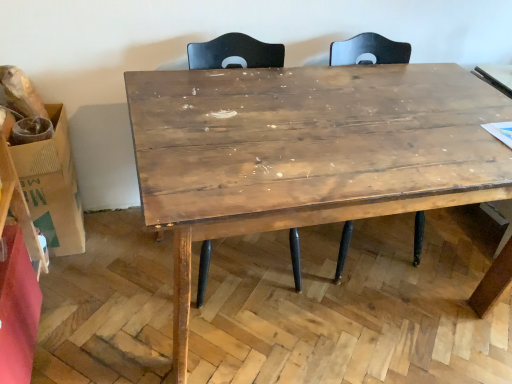
What is the approximate width of brown cardboard box at left?

brown cardboard box at left is 11.65 inches wide.

You are a GUI agent. You are given a task and a screenshot of the screen. Output one action in this format:
    pyautogui.click(x=<x>, y=<y>)
    Task: Click on the wooden table at center
    The height and width of the screenshot is (384, 512).
    Given the screenshot: What is the action you would take?
    pyautogui.click(x=306, y=151)

Is brown cardboard box at left at the left side of wooden table at center?

Yes.

Is brown cardboard box at left taller than wooden table at center?

In fact, brown cardboard box at left may be shorter than wooden table at center.

Which is closer, (x=28, y=172) or (x=195, y=223)?

Clearly, point (x=28, y=172) is more distant from the camera than point (x=195, y=223).

Which of these two, brown cardboard box at left or wooden table at center, is wider?

With larger width is wooden table at center.

Between matte wood swivel chair at center and wooden table at center, which one is positioned behind?

matte wood swivel chair at center is further from the camera.

In the scene shown: How different are the orientations of matte wood swivel chair at center and wooden table at center in degrees?

0.413 degrees.

From the image's perspective, does matte wood swivel chair at center appear higher than wooden table at center?

Yes, from the image's perspective, matte wood swivel chair at center is on top of wooden table at center.

What's the angular difference between wooden table at center and brown cardboard box at left's facing directions?

wooden table at center and brown cardboard box at left are facing 1.79 degrees away from each other.

Is wooden table at center not inside brown cardboard box at left?

wooden table at center lies outside brown cardboard box at left's area.

Is wooden table at center positioned before brown cardboard box at left?

Yes, wooden table at center is closer to the viewer.

Considering the sizes of objects wooden table at center and brown cardboard box at left in the image provided, who is wider, wooden table at center or brown cardboard box at left?

wooden table at center.

Measure the distance from matte wood swivel chair at center to brown cardboard box at left.

28.29 inches.

Is matte wood swivel chair at center with brown cardboard box at left?

matte wood swivel chair at center and brown cardboard box at left are clearly separated.

In terms of size, does matte wood swivel chair at center appear bigger or smaller than brown cardboard box at left?

matte wood swivel chair at center is bigger than brown cardboard box at left.

Is wooden table at center closer to camera compared to matte wood swivel chair at center?

Yes, the depth of wooden table at center is less than that of matte wood swivel chair at center.

From a real-world perspective, is wooden table at center positioned above or below matte wood swivel chair at center?

wooden table at center is situated lower than matte wood swivel chair at center in the real world.

From the image's perspective, which is below, wooden table at center or matte wood swivel chair at center?

wooden table at center is shown below in the image.

Is point (347, 216) closer to viewer compared to point (237, 47)?

Yes.

Is brown cardboard box at left aimed at matte wood swivel chair at center?

No, brown cardboard box at left does not turn towards matte wood swivel chair at center.

Is brown cardboard box at left in front of or behind matte wood swivel chair at center in the image?

Clearly, brown cardboard box at left is behind matte wood swivel chair at center.

This screenshot has width=512, height=384. I want to click on cardboard box that is under the matte wood swivel chair at center (from a real-world perspective), so click(52, 186).

Based on their positions, is brown cardboard box at left located to the left or right of matte wood swivel chair at center?

Based on their positions, brown cardboard box at left is located to the left of matte wood swivel chair at center.

Image resolution: width=512 pixels, height=384 pixels. In order to click on table located above the brown cardboard box at left (from a real-world perspective) in this screenshot , I will do pyautogui.click(x=306, y=151).

Find the location of a particular element. This screenshot has width=512, height=384. swivel chair above the wooden table at center (from the image's perspective) is located at coordinates (234, 53).

Which object lies nearer to the anchor point brown cardboard box at left, wooden table at center or matte wood swivel chair at center?

Among the two, matte wood swivel chair at center is located nearer to brown cardboard box at left.

When comparing their distances from matte wood swivel chair at center, does wooden table at center or brown cardboard box at left seem further?

Based on the image, brown cardboard box at left appears to be further to matte wood swivel chair at center.

From the image, which object appears to be farther from matte wood swivel chair at center, brown cardboard box at left or wooden table at center?

The object further to matte wood swivel chair at center is brown cardboard box at left.

Looking at this image, which object lies further to the anchor point wooden table at center, brown cardboard box at left or matte wood swivel chair at center?

Based on the image, brown cardboard box at left appears to be further to wooden table at center.

Which object lies nearer to the anchor point wooden table at center, matte wood swivel chair at center or brown cardboard box at left?

The object closer to wooden table at center is matte wood swivel chair at center.

Considering their positions, is matte wood swivel chair at center positioned further to brown cardboard box at left than wooden table at center?

wooden table at center lies further to brown cardboard box at left than the other object.

Locate an element on the screen. The width and height of the screenshot is (512, 384). swivel chair situated between brown cardboard box at left and wooden table at center from left to right is located at coordinates (234, 53).